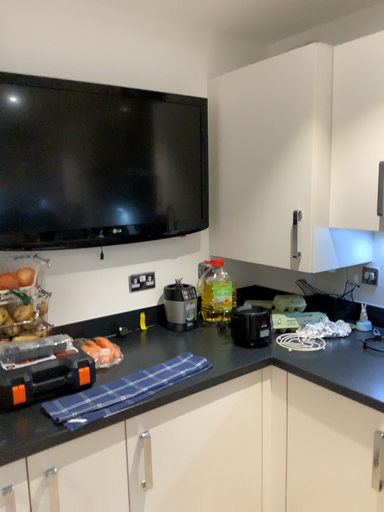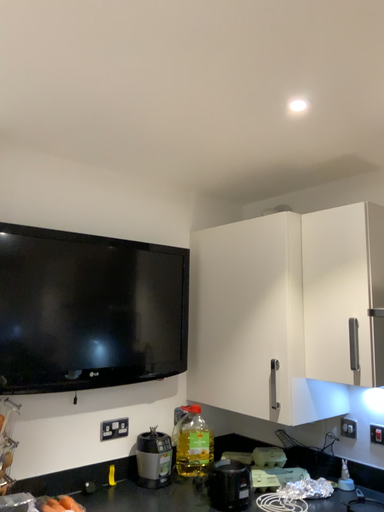
Question: How did the camera likely rotate when shooting the video?

Choices:
 (A) rotated downward
 (B) rotated upward

Answer: (B)